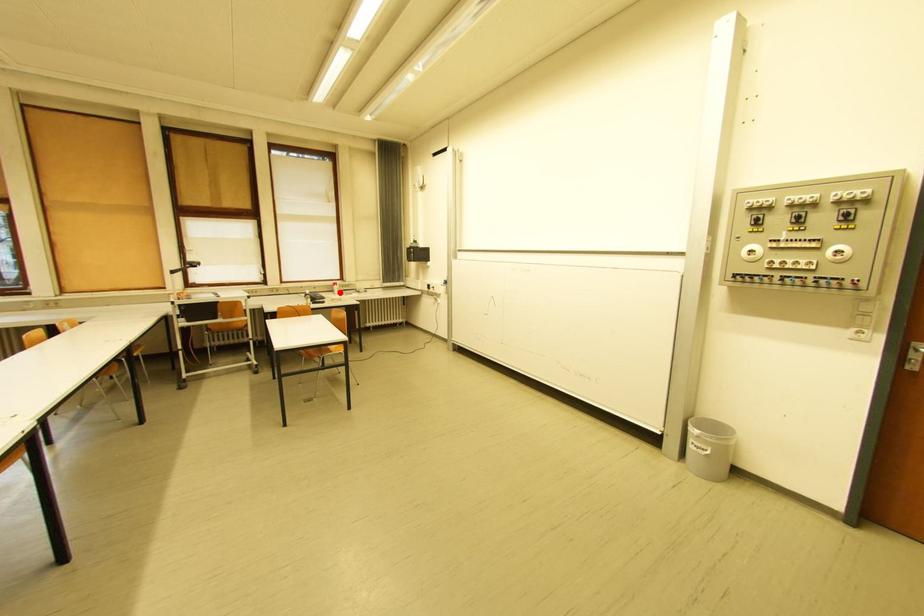
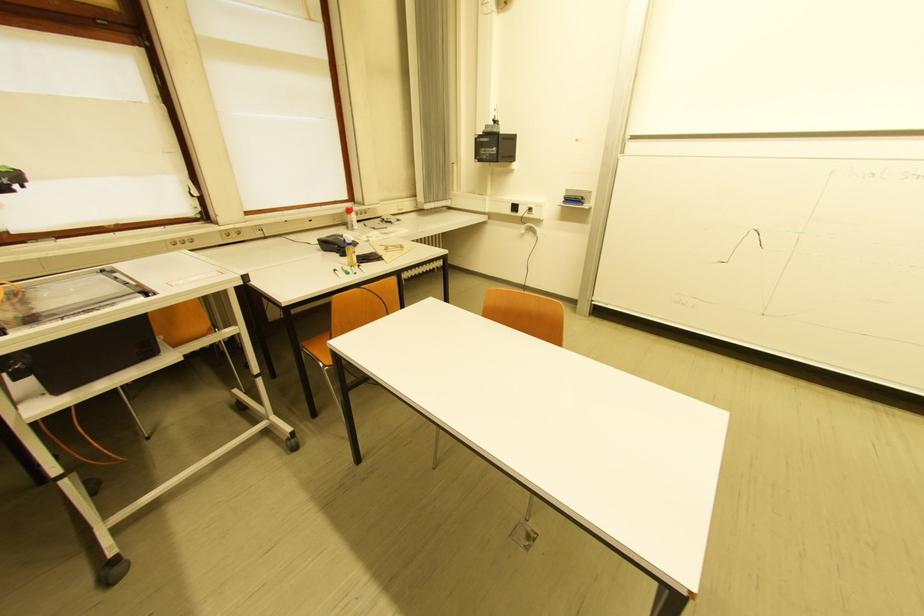
The point at the highlighted location is marked in the first image. Where is the corresponding point in the second image?

(351, 225)